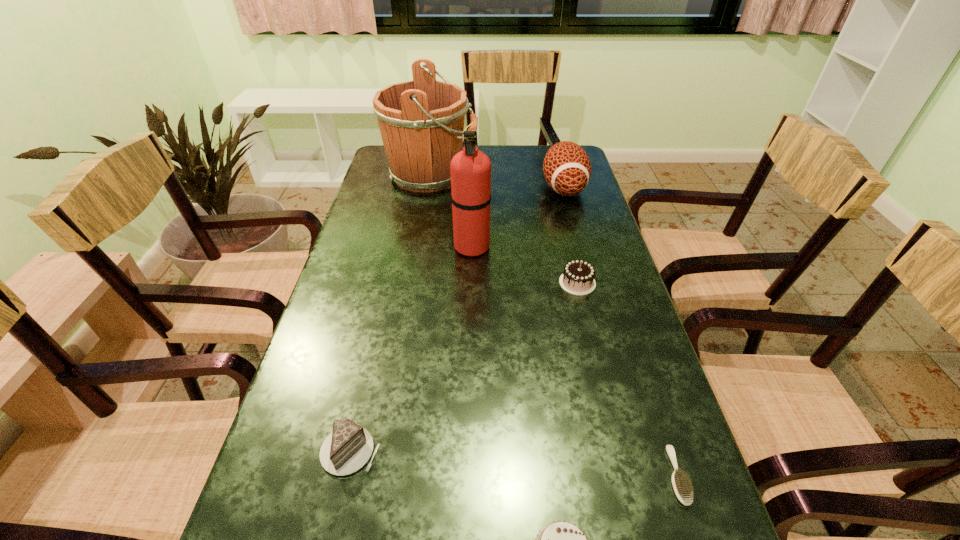
Where is `scrubbing brush that is positioned at the right edge`? This screenshot has height=540, width=960. scrubbing brush that is positioned at the right edge is located at coordinates (682, 487).

This screenshot has width=960, height=540. I want to click on object present at the far left corner, so click(x=419, y=121).

Find the location of a particular element. object situated at the far right corner is located at coordinates (567, 169).

This screenshot has width=960, height=540. I want to click on free space at the left edge of the desktop, so click(408, 207).

Find the location of a particular element. Image resolution: width=960 pixels, height=540 pixels. free space at the right edge of the desktop is located at coordinates (562, 254).

The height and width of the screenshot is (540, 960). In order to click on blank space at the far left corner of the desktop in this screenshot , I will do `click(388, 174)`.

In the image, there is a desktop. Identify the location of free space at the far right corner. (549, 147).

What are the coordinates of `unoccupied area between the bucket and the leftmost chocolate cake` in the screenshot? It's located at (391, 313).

This screenshot has width=960, height=540. I want to click on vacant area that lies between the fifth shortest object and the fourth nearest object, so [570, 235].

Image resolution: width=960 pixels, height=540 pixels. Find the location of `free point between the leftmost chocolate cake and the football`. free point between the leftmost chocolate cake and the football is located at coordinates (457, 320).